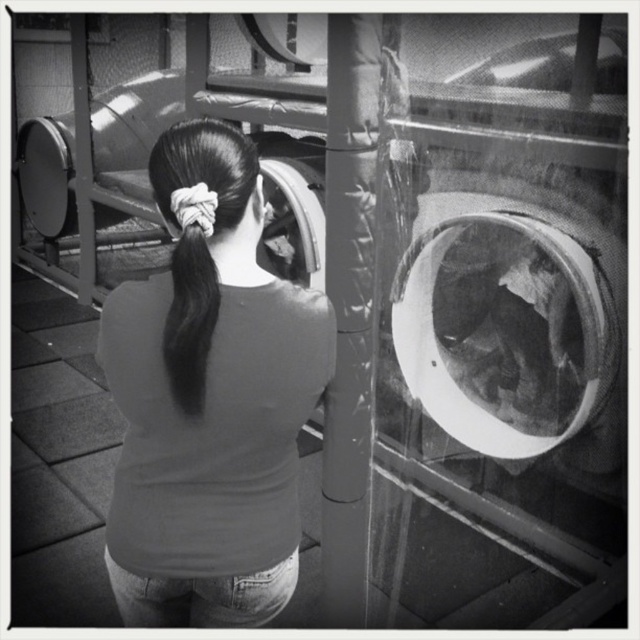
You are an observer looking at the image. You notice the smooth gray shirt at center and the black silky hair at center. Which object is located lower in the image?

The smooth gray shirt at center is positioned under the black silky hair at center, so the smooth gray shirt at center is lower in the image.